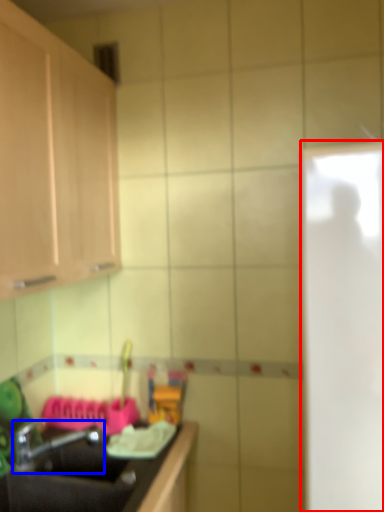
Question: Which point is closer to the camera, glass door (highlighted by a red box) or tap (highlighted by a blue box)?

Choices:
 (A) glass door
 (B) tap

Answer: (A)